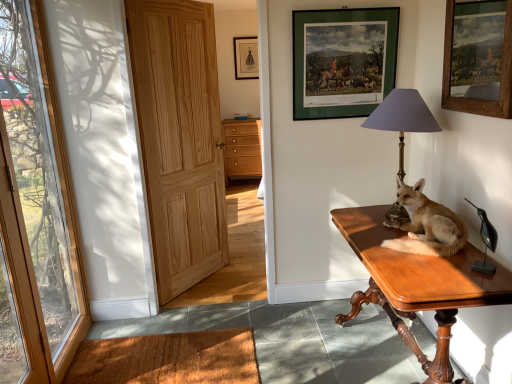
The width and height of the screenshot is (512, 384). In order to click on free point above brown shaggy carpet at lower left (from a real-world perspective) in this screenshot , I will do `click(261, 345)`.